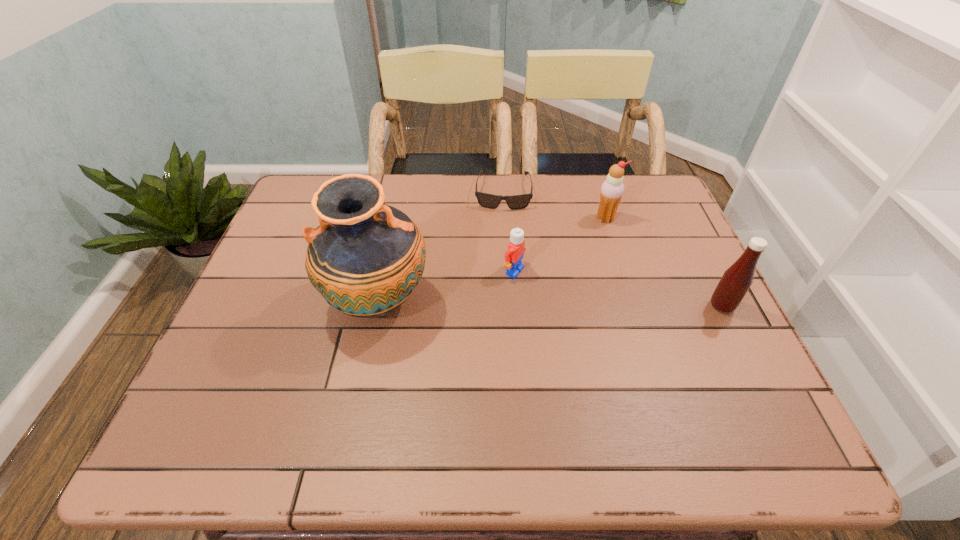
The width and height of the screenshot is (960, 540). What are the coordinates of `sunglasses positioned at the far edge` in the screenshot? It's located at pos(486,200).

The width and height of the screenshot is (960, 540). Identify the location of object that is at the right edge. (737, 279).

You are a GUI agent. You are given a task and a screenshot of the screen. Output one action in this format:
    pyautogui.click(x=<x>, y=<y>)
    Task: Click on the vacant space at the far edge of the desktop
    Image resolution: width=960 pixels, height=540 pixels.
    Given the screenshot: What is the action you would take?
    pyautogui.click(x=416, y=196)

Locate an element on the screen. The image size is (960, 540). blank space at the near edge of the desktop is located at coordinates (557, 373).

The width and height of the screenshot is (960, 540). Find the location of `free space at the left edge of the desktop`. free space at the left edge of the desktop is located at coordinates (235, 326).

Where is `free space at the right edge`? free space at the right edge is located at coordinates (654, 246).

Locate an element on the screen. This screenshot has height=540, width=960. vacant space at the far left corner of the desktop is located at coordinates (285, 215).

Find the location of a particular element. free space at the near right corner of the desktop is located at coordinates (703, 394).

Image resolution: width=960 pixels, height=540 pixels. In order to click on free spot between the rightmost object and the farthest object in this screenshot , I will do `click(612, 248)`.

Where is `free space between the Tabasco sauce and the farthest object`? free space between the Tabasco sauce and the farthest object is located at coordinates (612, 248).